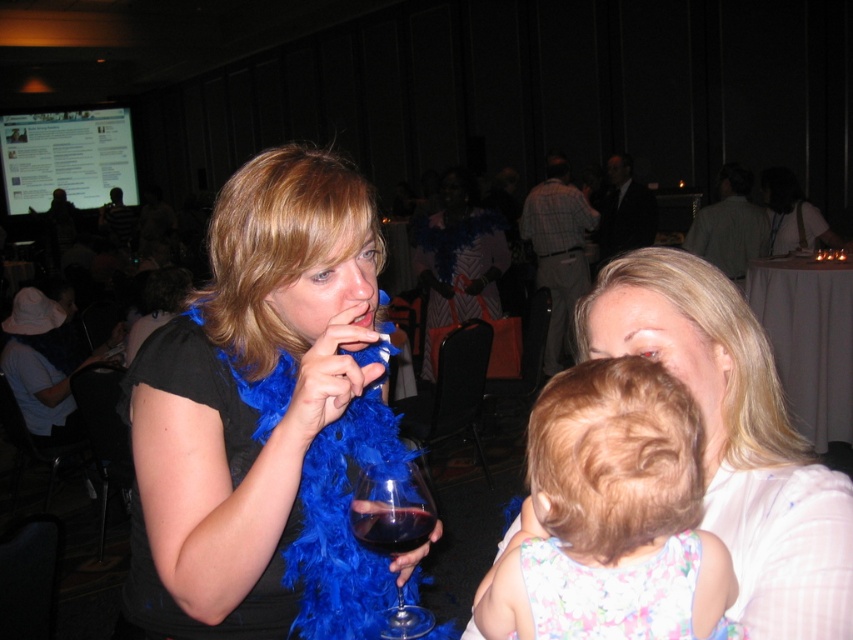
Question: Which point is farther to the camera?

Choices:
 (A) (689, 312)
 (B) (370, 342)
 (C) (367, 472)
 (D) (363, 532)

Answer: (B)

Question: Among these points, which one is nearest to the camera?

Choices:
 (A) (802, 608)
 (B) (405, 509)
 (C) (409, 481)

Answer: (A)

Question: Can you confirm if blue feather boa at center is wider than transparent glass wine glass at center?

Choices:
 (A) no
 (B) yes

Answer: (B)

Question: Is blue feather boa at center positioned behind transparent glass wine glass at center?

Choices:
 (A) yes
 (B) no

Answer: (B)

Question: Can you confirm if smooth white blouse at center is thinner than transparent glass wine glass at center?

Choices:
 (A) yes
 (B) no

Answer: (B)

Question: Which object is closer to the camera taking this photo?

Choices:
 (A) dark glass beverage at center
 (B) smooth white blouse at center

Answer: (B)